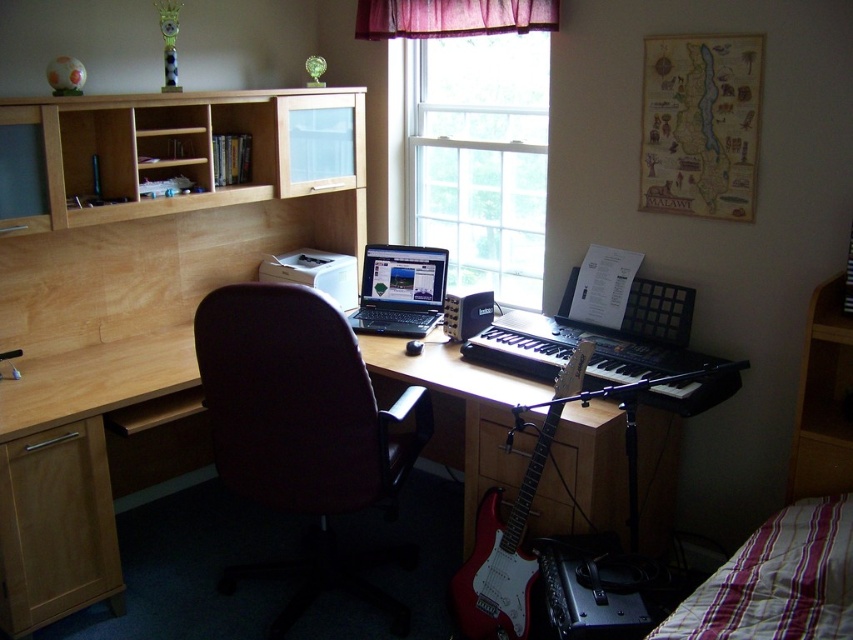
Does brown leather swivel chair at center have a larger size compared to black plastic laptop at center?

Yes.

Who is shorter, brown leather swivel chair at center or black plastic laptop at center?

With less height is black plastic laptop at center.

Identify the location of brown leather swivel chair at center. (305, 435).

Can you confirm if transparent glass window at center is bigger than black matte keyboard at center?

Indeed, transparent glass window at center has a larger size compared to black matte keyboard at center.

Is point (459, 150) closer to viewer compared to point (610, 330)?

No, it is not.

The image size is (853, 640). I want to click on transparent glass window at center, so click(479, 157).

Who is shorter, brown leather swivel chair at center or striped fabric bed at lower right?

Standing shorter between the two is striped fabric bed at lower right.

Does brown leather swivel chair at center lie behind striped fabric bed at lower right?

Yes.

Locate an element on the screen. This screenshot has width=853, height=640. brown leather swivel chair at center is located at coordinates (305, 435).